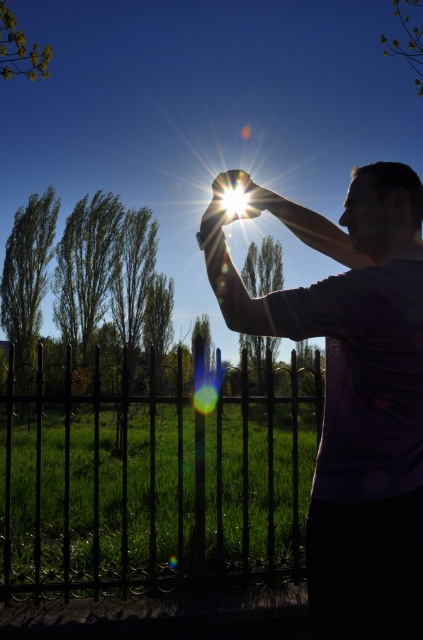
Is point (99, 560) positioned after point (18, 52)?

No, (99, 560) is in front of (18, 52).

Does black wrought iron fence at center have a greater height compared to green leafy tree at upper left?

Incorrect, black wrought iron fence at center's height is not larger of green leafy tree at upper left's.

Is point (296, 522) less distant than point (33, 77)?

Yes.

Locate an element on the screen. This screenshot has width=423, height=640. black wrought iron fence at center is located at coordinates (153, 481).

Between point (10, 67) and point (406, 52), which one is positioned in front?

Point (10, 67)

Does point (36, 44) come behind point (403, 12)?

Yes, point (36, 44) is farther from viewer.

Where is `green leafy tree at upper left`? The width and height of the screenshot is (423, 640). green leafy tree at upper left is located at coordinates (19, 49).

Identify the location of green leafy tree at upper left. (19, 49).

Does green leafy tree at left appear under green leafy tree at upper left?

Yes, green leafy tree at left is below green leafy tree at upper left.

Which is above, green leafy tree at left or green leafy tree at upper left?

green leafy tree at upper left

Describe the element at coordinates (27, 280) in the screenshot. This screenshot has width=423, height=640. I see `green leafy tree at left` at that location.

Find the location of a particular element. The image size is (423, 640). green leafy tree at left is located at coordinates (27, 280).